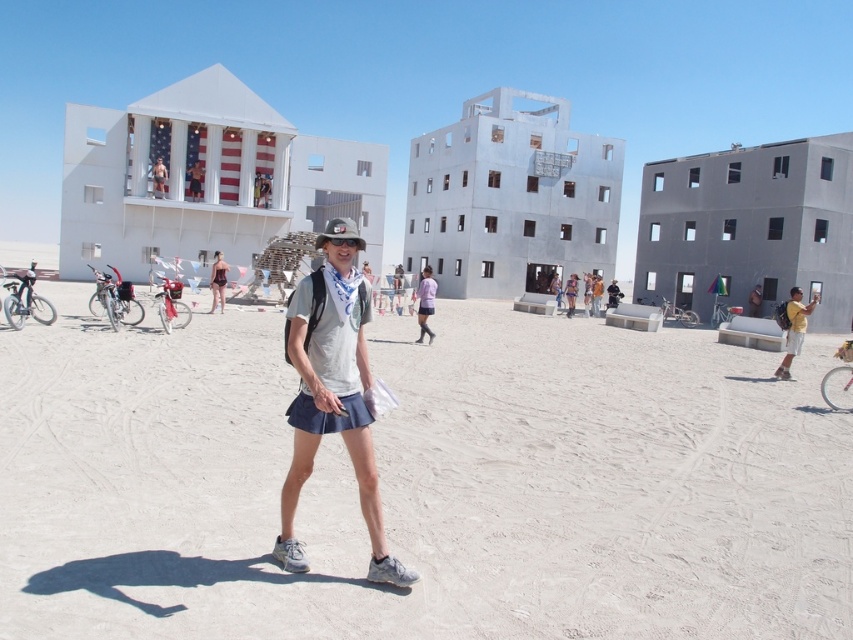
You are a photographer at the festival and want to capture both the yellow backpack at lower right and the purple fabric skirt at center in the same frame. Which object should you position closer to the left side of your camera viewfinder to include both?

To include both the yellow backpack at lower right and the purple fabric skirt at center in the same frame, you should position the purple fabric skirt at center closer to the left side of your camera viewfinder since the yellow backpack at lower right is already on its right side.

You are standing at the location of the person in the image. You want to reach the American flag displayed on one of the large structures. The flag is located at point (631, 604). If you can walk 5 meters before needing to rest, will you be able to reach the flag without resting?

The distance between you and the American flag at point (631, 604) is 4.27 meters, which is less than 5 meters. Therefore, you can reach the flag without needing to rest.

You are an artist at the festival and need to decide where to place a new sculpture. The sculpture requires a base that must be taller than both the yellow backpack at lower right and the purple fabric skirt at center. Which object should you compare the sculpture base height to ensure it meets the requirement?

The sculpture base must be taller than the purple fabric skirt at center because it is taller than the yellow backpack at lower right.